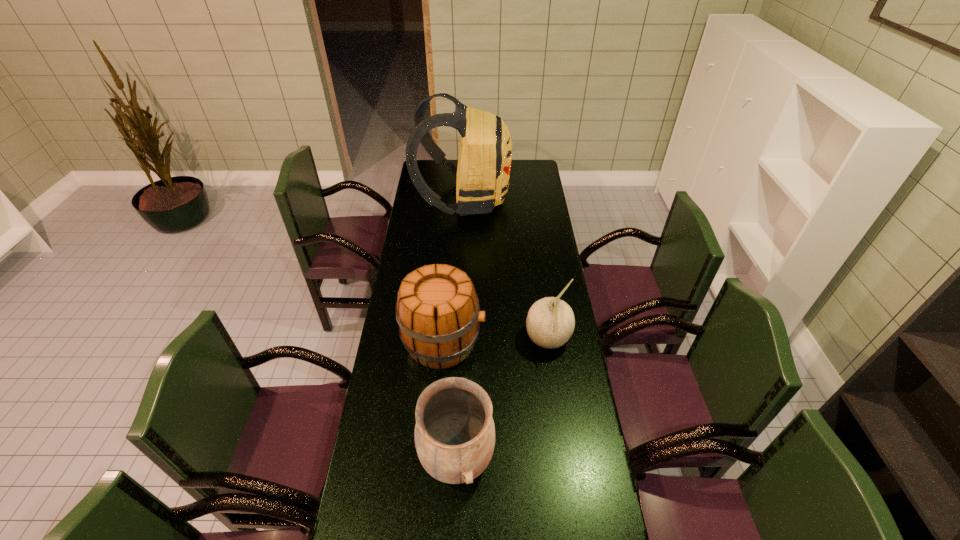
In order to click on backpack located in the left edge section of the desktop in this screenshot , I will do `click(485, 154)`.

The height and width of the screenshot is (540, 960). I want to click on cider that is at the left edge, so click(x=437, y=309).

I want to click on object present at the right edge, so click(550, 322).

This screenshot has width=960, height=540. In order to click on object at the far left corner in this screenshot , I will do `click(485, 154)`.

The image size is (960, 540). In order to click on free spot at the far edge of the desktop in this screenshot , I will do `click(448, 178)`.

Identify the location of vacant region at the left edge. Image resolution: width=960 pixels, height=540 pixels. (432, 258).

In the image, there is a desktop. Identify the location of vacant space at the right edge. (587, 501).

Locate an element on the screen. vacant space at the far right corner is located at coordinates (533, 165).

You are a GUI agent. You are given a task and a screenshot of the screen. Output one action in this format:
    pyautogui.click(x=<x>, y=<y>)
    Task: Click on the empty location between the cider and the rightmost object
    This screenshot has height=540, width=960.
    Given the screenshot: What is the action you would take?
    pyautogui.click(x=495, y=341)

Where is `free space between the cantaloup and the cider`? free space between the cantaloup and the cider is located at coordinates (495, 341).